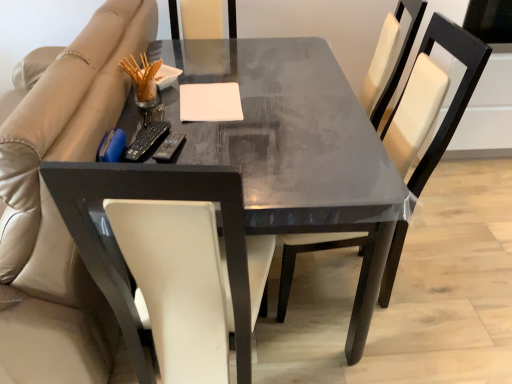
Question: Is beige leather couch at left bigger than white matte notepad at center?

Choices:
 (A) no
 (B) yes

Answer: (B)

Question: Is beige leather couch at left taller than white matte notepad at center?

Choices:
 (A) yes
 (B) no

Answer: (A)

Question: Does beige leather couch at left have a greater width compared to white matte notepad at center?

Choices:
 (A) yes
 (B) no

Answer: (A)

Question: Is the depth of beige leather couch at left greater than that of white matte notepad at center?

Choices:
 (A) no
 (B) yes

Answer: (A)

Question: From a real-world perspective, is beige leather couch at left over white matte notepad at center?

Choices:
 (A) no
 (B) yes

Answer: (A)

Question: Is point (245, 112) positioned closer to the camera than point (365, 244)?

Choices:
 (A) farther
 (B) closer

Answer: (A)

Question: From the image's perspective, is matte black table at center located above or below white leather chair at center?

Choices:
 (A) below
 (B) above

Answer: (B)

Question: From their relative heights in the image, would you say matte black table at center is taller or shorter than white leather chair at center?

Choices:
 (A) short
 (B) tall

Answer: (A)

Question: Based on their sizes in the image, would you say matte black table at center is bigger or smaller than white leather chair at center?

Choices:
 (A) big
 (B) small

Answer: (A)

Question: From the image's perspective, is matte black table at center above or below beige leather couch at left?

Choices:
 (A) below
 (B) above

Answer: (A)

Question: From a real-world perspective, is matte black table at center positioned above or below beige leather couch at left?

Choices:
 (A) below
 (B) above

Answer: (A)

Question: In terms of size, does matte black table at center appear bigger or smaller than beige leather couch at left?

Choices:
 (A) big
 (B) small

Answer: (B)

Question: Is matte black table at center to the left or to the right of beige leather couch at left in the image?

Choices:
 (A) right
 (B) left

Answer: (A)

Question: Considering the positions of white leather chair at center and white matte notepad at center in the image, is white leather chair at center bigger or smaller than white matte notepad at center?

Choices:
 (A) big
 (B) small

Answer: (A)

Question: In the image, is white leather chair at center positioned in front of or behind white matte notepad at center?

Choices:
 (A) front
 (B) behind

Answer: (A)